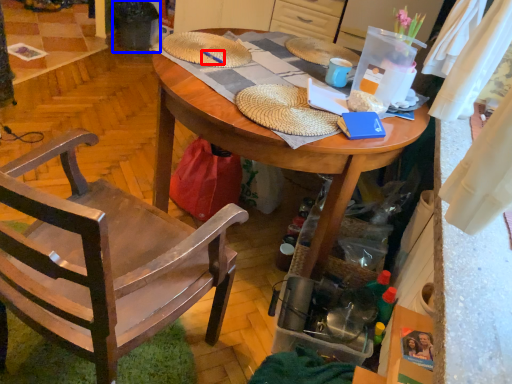
Question: Among these objects, which one is nearest to the camera, pen (highlighted by a red box) or trash bin/can (highlighted by a blue box)?

Choices:
 (A) pen
 (B) trash bin/can

Answer: (A)